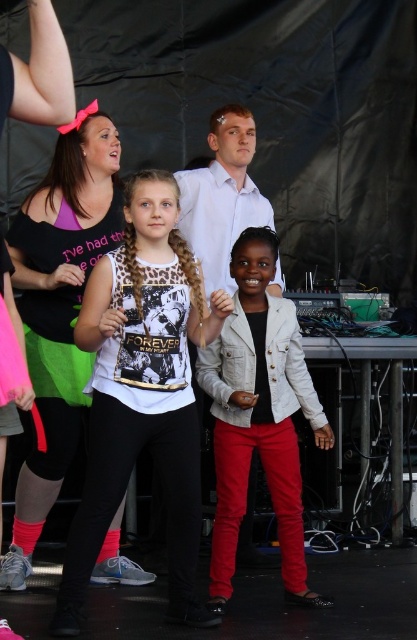
Who is higher up, leopard print tank top at center or light gray denim jacket at center?

leopard print tank top at center is above.

Find the location of a particular element. This screenshot has height=640, width=417. leopard print tank top at center is located at coordinates click(x=143, y=392).

Where is `leopard print tank top at center`? The width and height of the screenshot is (417, 640). leopard print tank top at center is located at coordinates (143, 392).